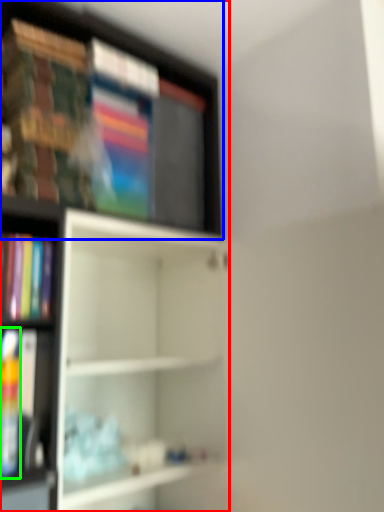
Question: Considering the real-world distances, which object is farthest from shelf (highlighted by a red box)? shelf (highlighted by a blue box) or book (highlighted by a green box)?

Choices:
 (A) shelf
 (B) book

Answer: (B)